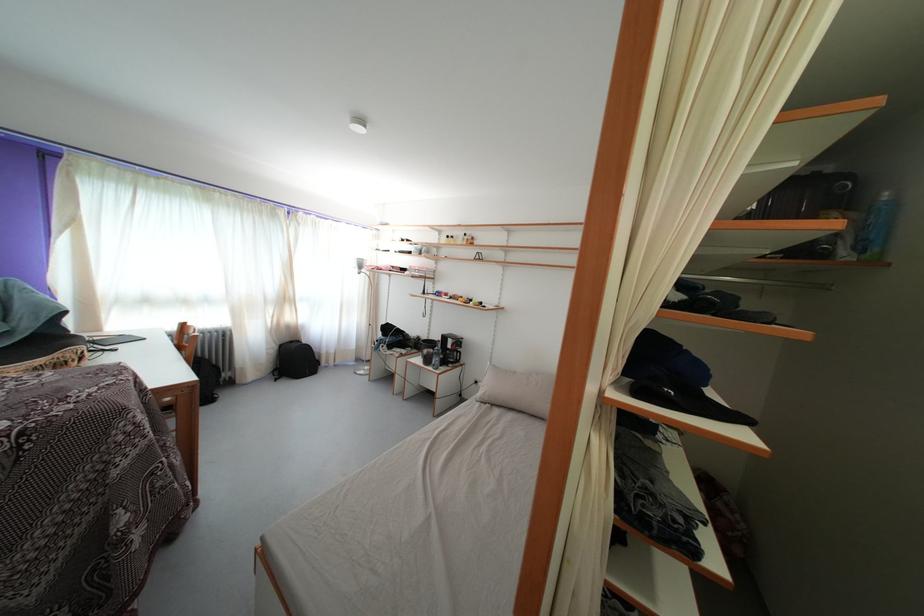
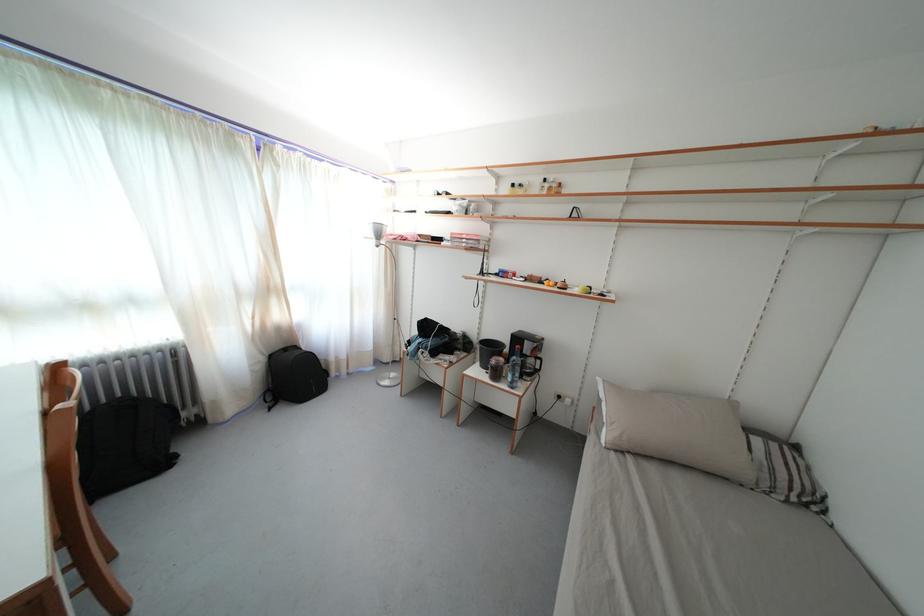
In a continuous first-person perspective shot, in which direction is the camera moving?

The movement direction of the cameraman is left, forward.